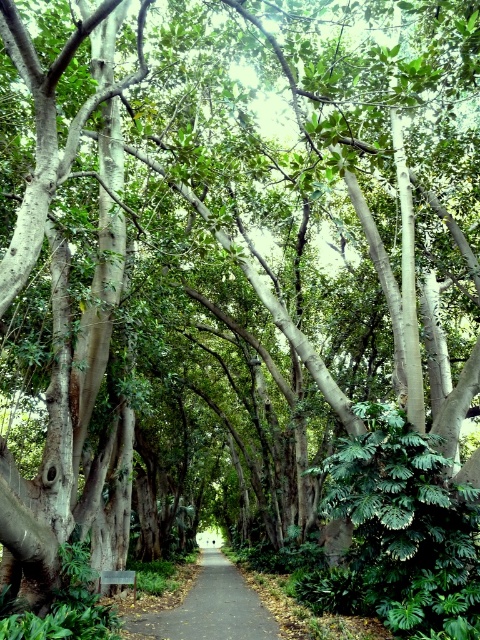
Question: Can you confirm if dark gray asphalt path at center is thinner than wooden bench at center?

Choices:
 (A) yes
 (B) no

Answer: (B)

Question: Which point appears farthest from the camera in this image?

Choices:
 (A) (132, 579)
 (B) (220, 600)

Answer: (B)

Question: Which object appears closest to the camera in this image?

Choices:
 (A) wooden bench at center
 (B) dark gray asphalt path at center

Answer: (B)

Question: Can you confirm if dark gray asphalt path at center is positioned above wooden bench at center?

Choices:
 (A) yes
 (B) no

Answer: (B)

Question: Is dark gray asphalt path at center above wooden bench at center?

Choices:
 (A) no
 (B) yes

Answer: (A)